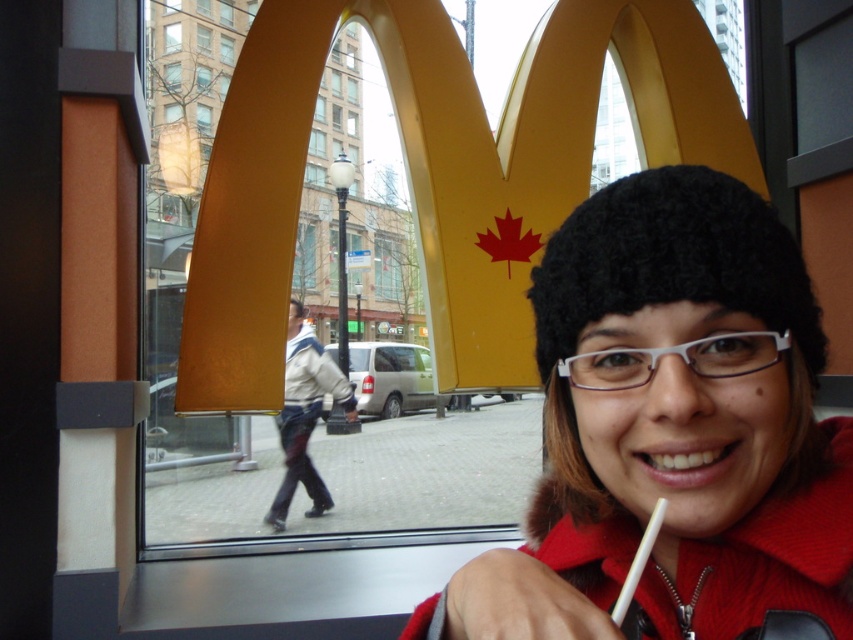
Describe the element at coordinates (671, 428) in the screenshot. I see `black fuzzy hat at upper center` at that location.

Who is more forward, (830, 598) or (306, 428)?

Positioned in front is point (830, 598).

Between point (564, 420) and point (291, 404), which one is positioned in front?

Point (564, 420) is in front.

You are a GUI agent. You are given a task and a screenshot of the screen. Output one action in this format:
    pyautogui.click(x=<x>, y=<y>)
    Task: Click on the black fuzzy hat at upper center
    
    Given the screenshot: What is the action you would take?
    pyautogui.click(x=671, y=428)